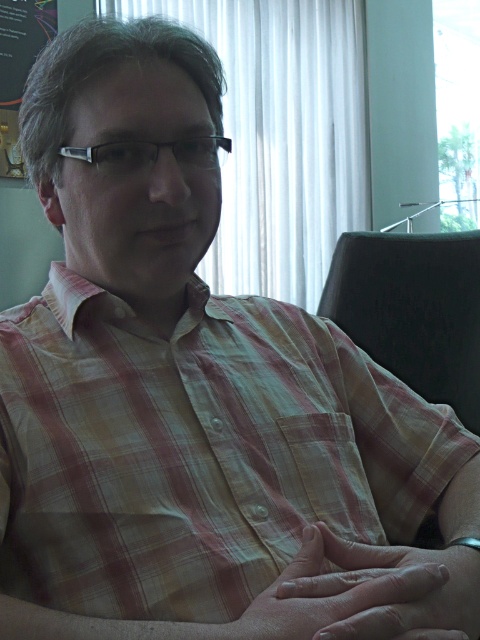
You are a photographer taking a portrait and want to focus on the smooth skin hand at center. Since the hand is 17.88 inches away from the camera, what should be the minimum focal length of your lens to ensure the hand fills the frame without distortion?

The smooth skin hand at center is 17.88 inches away from the camera. To ensure it fills the frame without distortion, the lens should have a focal length of at least 50mm.

You are an interior designer evaluating the placement of two points in a room. You need to determine which point is closer to the viewer. The points are labeled as point (465, 289) and point (142, 150). Which point is closer to the viewer?

Point (142, 150) is closer to the viewer because it is positioned nearer than point (465, 289), which is further away.